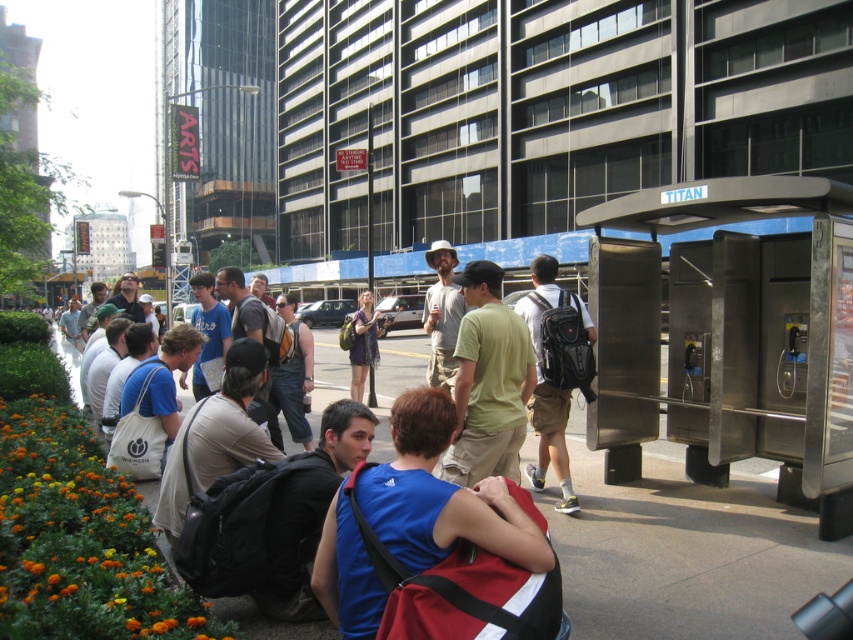
You are a delivery drone trying to navigate through the city scene. You need to drop off a package at the public phone booth labeled TITAN. There is an orange fabric flower at lower left in your path. Can you safely pass around it without hitting the flower?

The orange fabric flower at lower left is located at point [79,540]. Since the flower is at a specific coordinate, the drone can adjust its path to avoid it by navigating around the coordinates provided, ensuring a safe delivery to the phone booth labeled TITAN.